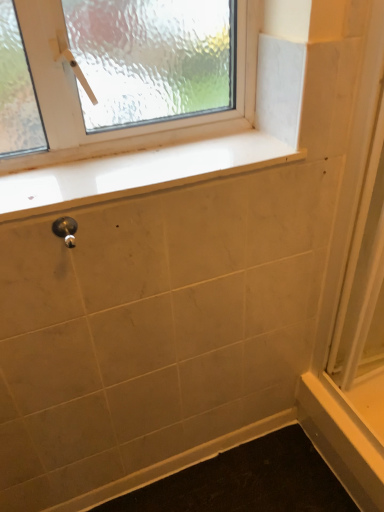
Question: Is point (56, 230) closer or farther from the camera than point (380, 86)?

Choices:
 (A) closer
 (B) farther

Answer: (A)

Question: Considering the positions of polished silver door handle at lower left and white glossy screen door at right in the image, is polished silver door handle at lower left bigger or smaller than white glossy screen door at right?

Choices:
 (A) small
 (B) big

Answer: (A)

Question: Which of these objects is positioned farthest from the white glossy screen door at right?

Choices:
 (A) polished silver door handle at lower left
 (B) white glossy window sill at upper center

Answer: (A)

Question: Based on their relative distances, which object is farther from the white glossy window sill at upper center?

Choices:
 (A) polished silver door handle at lower left
 (B) white glossy screen door at right

Answer: (B)